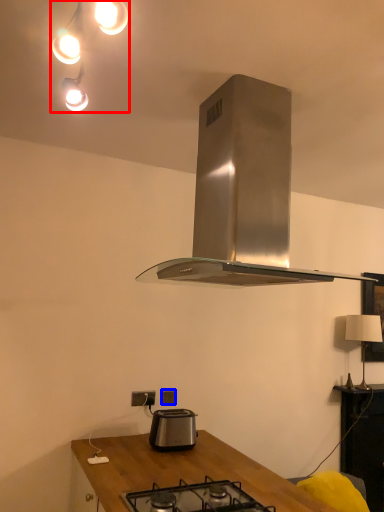
Question: Among these objects, which one is farthest to the camera, light fixture (highlighted by a red box) or power plugs and sockets (highlighted by a blue box)?

Choices:
 (A) light fixture
 (B) power plugs and sockets

Answer: (B)